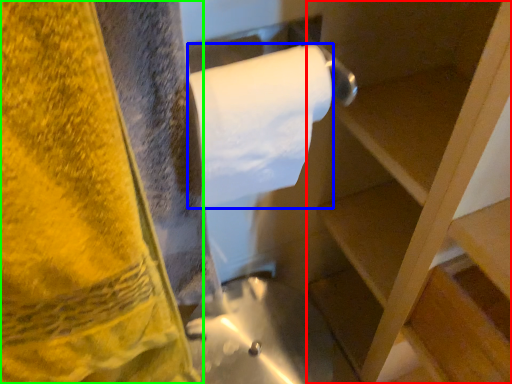
Question: Considering the real-world distances, which object is closest to shelf (highlighted by a red box)? toilet paper (highlighted by a blue box) or towel (highlighted by a green box).

Choices:
 (A) toilet paper
 (B) towel

Answer: (A)